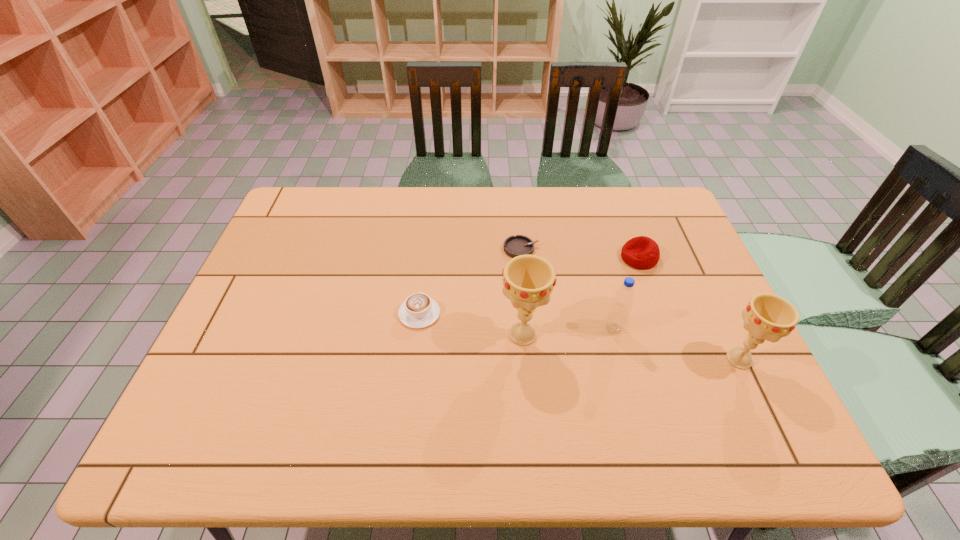
The image size is (960, 540). In order to click on the taller chalice in this screenshot , I will do `click(528, 280)`.

In order to click on the tallest object in this screenshot , I will do `click(528, 280)`.

The image size is (960, 540). Find the location of `the right chalice`. the right chalice is located at coordinates (769, 317).

What are the coordinates of `the rightmost object` in the screenshot? It's located at (769, 317).

Locate an element on the screen. This screenshot has height=540, width=960. ashtray is located at coordinates (514, 246).

Locate an element on the screen. the second object from right to left is located at coordinates (641, 252).

Find the location of a particular element. the third shortest object is located at coordinates (641, 252).

Where is `water bottle`? water bottle is located at coordinates pos(624,296).

Locate an element on the screen. This screenshot has width=960, height=540. cappuccino is located at coordinates (418, 311).

Where is `the second shortest object`? The image size is (960, 540). the second shortest object is located at coordinates (418, 311).